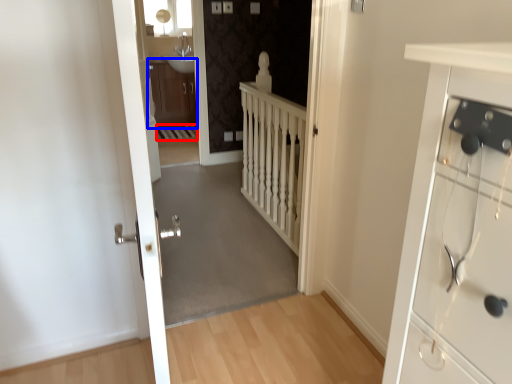
Question: Which point is further to the camera, stairwell (highlighted by a red box) or cabinetry (highlighted by a blue box)?

Choices:
 (A) stairwell
 (B) cabinetry

Answer: (B)